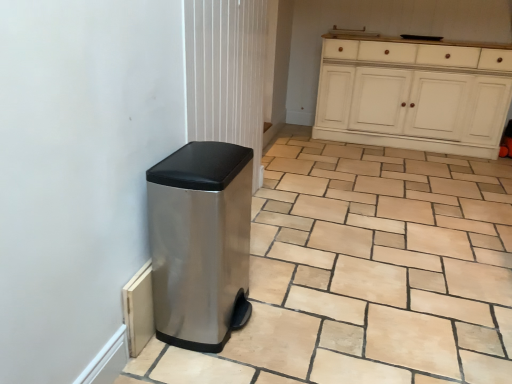
Question: Does point (462, 188) appear closer or farther from the camera than point (161, 205)?

Choices:
 (A) farther
 (B) closer

Answer: (A)

Question: Is beige stone tile at lower center spatially inside polished stainless steel trash can at lower left, or outside of it?

Choices:
 (A) outside
 (B) inside

Answer: (A)

Question: Which object is positioned closest to the white painted wood cabinet at upper right?

Choices:
 (A) polished stainless steel trash can at lower left
 (B) beige stone tile at lower center

Answer: (B)

Question: Considering the real-world distances, which object is closest to the beige stone tile at lower center?

Choices:
 (A) polished stainless steel trash can at lower left
 (B) white painted wood cabinet at upper right

Answer: (A)